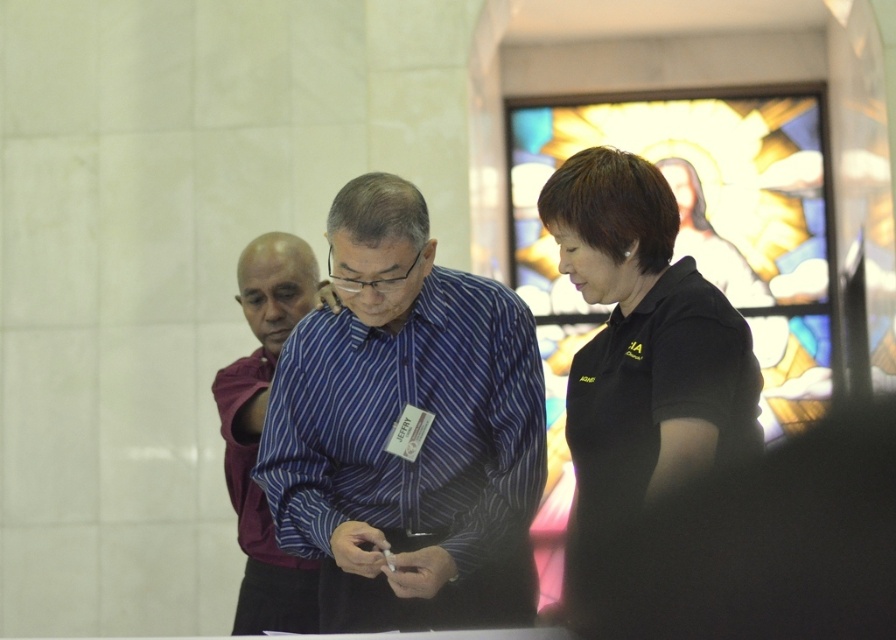
Does blue striped shirt at center have a greater height compared to black matte shirt at center?

Yes.

Is the position of blue striped shirt at center less distant than that of black matte shirt at center?

No.

Identify the location of blue striped shirt at center. (406, 429).

Can you confirm if stained glass at upper right is positioned below black matte shirt at center?

Actually, stained glass at upper right is above black matte shirt at center.

Identify the location of stained glass at upper right. (705, 214).

Looking at this image, who is higher up, blue striped shirt at center or maroon fabric shirt at left?

blue striped shirt at center is higher up.

Image resolution: width=896 pixels, height=640 pixels. What do you see at coordinates (406, 429) in the screenshot? I see `blue striped shirt at center` at bounding box center [406, 429].

Based on the photo, who is more distant from viewer, (x=412, y=408) or (x=246, y=522)?

The point (x=246, y=522) is behind.

Where is `blue striped shirt at center`? The width and height of the screenshot is (896, 640). blue striped shirt at center is located at coordinates (406, 429).